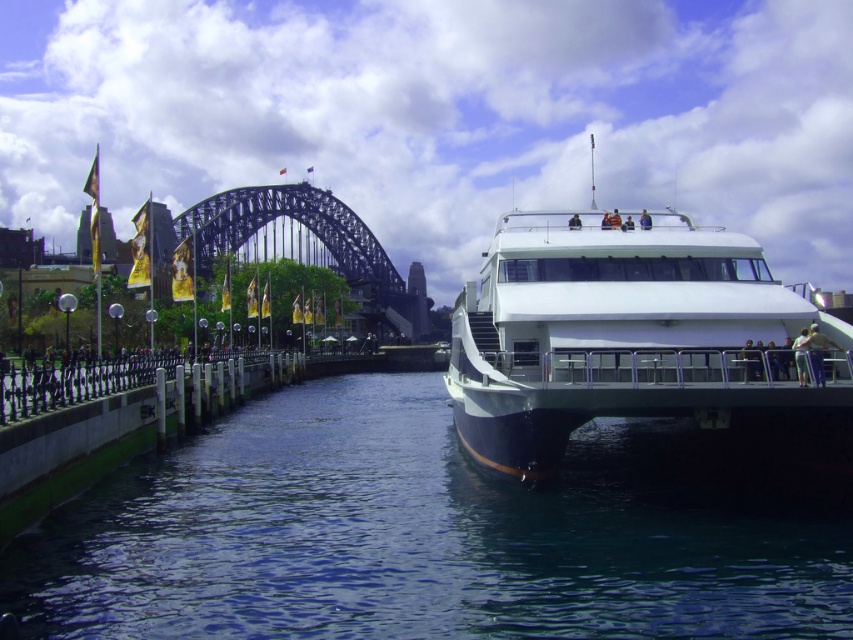
Question: Does blue water at center have a larger size compared to white glossy cruise ship at center?

Choices:
 (A) yes
 (B) no

Answer: (B)

Question: Is white glossy cruise ship at center to the right of metallic steel bridge at upper center from the viewer's perspective?

Choices:
 (A) yes
 (B) no

Answer: (A)

Question: Estimate the real-world distances between objects in this image. Which object is farther from the white glossy cruise ship at center?

Choices:
 (A) metallic steel bridge at upper center
 (B) blue water at center

Answer: (A)

Question: Among these points, which one is nearest to the camera?

Choices:
 (A) (334, 264)
 (B) (225, 538)

Answer: (B)

Question: Can you confirm if blue water at center is smaller than metallic steel bridge at upper center?

Choices:
 (A) yes
 (B) no

Answer: (A)

Question: Based on their relative distances, which object is nearer to the blue water at center?

Choices:
 (A) metallic steel bridge at upper center
 (B) white glossy cruise ship at center

Answer: (B)